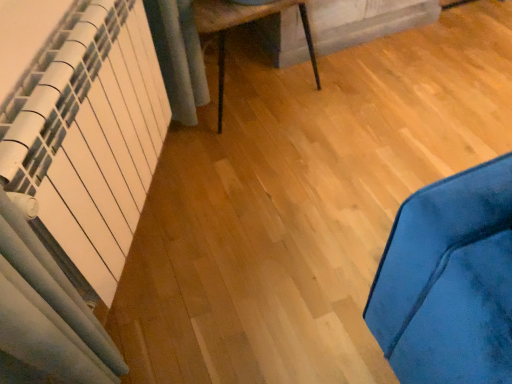
In order to face white matte radiator at left, should I rotate leftwards or rightwards?

Rotate left and turn 17.783 degrees.

This screenshot has height=384, width=512. In order to click on white matte radiator at left in this screenshot , I will do `click(92, 139)`.

What do you see at coordinates (92, 139) in the screenshot? I see `white matte radiator at left` at bounding box center [92, 139].

Describe the element at coordinates (241, 24) in the screenshot. Image resolution: width=512 pixels, height=384 pixels. I see `wooden table at center` at that location.

The width and height of the screenshot is (512, 384). In order to click on wooden table at center in this screenshot , I will do `click(241, 24)`.

Identify the location of white matte radiator at left. (92, 139).

Looking at this image, which object is positioned more to the right, wooden table at center or white matte radiator at left?

wooden table at center is more to the right.

Considering their positions, is wooden table at center located in front of or behind white matte radiator at left?

In the image, wooden table at center appears behind white matte radiator at left.

Does point (310, 37) lie behind point (85, 219)?

Yes, it is.

From the image's perspective, which is below, wooden table at center or white matte radiator at left?

white matte radiator at left appears lower in the image.

From a real-world perspective, which object stands above the other?

white matte radiator at left, from a real-world perspective.

Considering the sizes of wooden table at center and white matte radiator at left in the image, is wooden table at center wider or thinner than white matte radiator at left?

Considering their sizes, wooden table at center looks broader than white matte radiator at left.

Considering the sizes of objects wooden table at center and white matte radiator at left in the image provided, who is shorter, wooden table at center or white matte radiator at left?

Standing shorter between the two is wooden table at center.

Considering the sizes of objects wooden table at center and white matte radiator at left in the image provided, who is bigger, wooden table at center or white matte radiator at left?

Bigger between the two is wooden table at center.

Is wooden table at center situated inside white matte radiator at left or outside?

wooden table at center exists outside the volume of white matte radiator at left.

Are wooden table at center and white matte radiator at left making contact?

No.

Is wooden table at center oriented towards white matte radiator at left?

No, wooden table at center does not turn towards white matte radiator at left.

How different are the orientations of wooden table at center and white matte radiator at left in degrees?

wooden table at center and white matte radiator at left are facing 9.5 degrees away from each other.

Locate an element on the screen. The height and width of the screenshot is (384, 512). furniture on the right of white matte radiator at left is located at coordinates (241, 24).

Consider the image. Which object is positioned more to the right, white matte radiator at left or wooden table at center?

From the viewer's perspective, wooden table at center appears more on the right side.

Which object is further away from the camera, white matte radiator at left or wooden table at center?

wooden table at center is more distant.

Is point (121, 111) more distant than point (197, 0)?

No, (121, 111) is closer to viewer.

Looking at this image, from the image's perspective, is white matte radiator at left above wooden table at center?

Incorrect, from the image's perspective, white matte radiator at left is lower than wooden table at center.

From a real-world perspective, who is located lower, white matte radiator at left or wooden table at center?

wooden table at center, from a real-world perspective.

Looking at their sizes, would you say white matte radiator at left is wider or thinner than wooden table at center?

Clearly, white matte radiator at left has less width compared to wooden table at center.

Does white matte radiator at left have a lesser height compared to wooden table at center?

In fact, white matte radiator at left may be taller than wooden table at center.

Based on their sizes in the image, would you say white matte radiator at left is bigger or smaller than wooden table at center?

Clearly, white matte radiator at left is smaller in size than wooden table at center.

Is white matte radiator at left inside the boundaries of wooden table at center, or outside?

white matte radiator at left cannot be found inside wooden table at center.

Can you see white matte radiator at left touching wooden table at center?

No, white matte radiator at left is not in contact with wooden table at center.

Is white matte radiator at left oriented away from wooden table at center?

No, white matte radiator at left is not facing the opposite direction of wooden table at center.

Can you tell me how much white matte radiator at left and wooden table at center differ in facing direction?

white matte radiator at left and wooden table at center are facing 9.5 degrees away from each other.

How distant is white matte radiator at left from wooden table at center?

23.10 inches.

Locate an element on the screen. This screenshot has width=512, height=384. furniture that appears on the right of white matte radiator at left is located at coordinates (241, 24).

Where is `furniture below the white matte radiator at left (from a real-world perspective)`? furniture below the white matte radiator at left (from a real-world perspective) is located at coordinates (241, 24).

You are a GUI agent. You are given a task and a screenshot of the screen. Output one action in this format:
    pyautogui.click(x=<x>, y=<y>)
    Task: Click on the furniture above the white matte radiator at left (from the image's perspective)
    The image size is (512, 384).
    Given the screenshot: What is the action you would take?
    pyautogui.click(x=241, y=24)